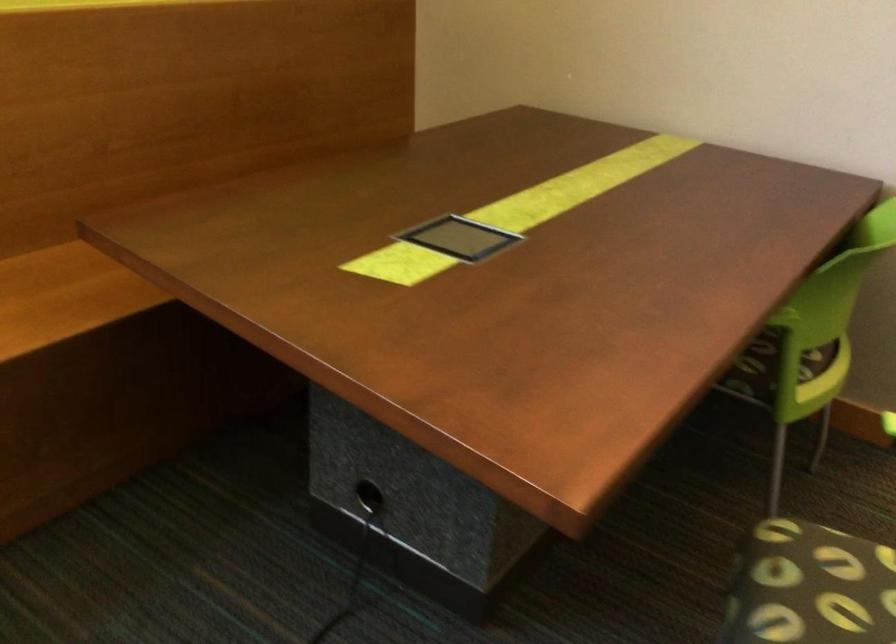
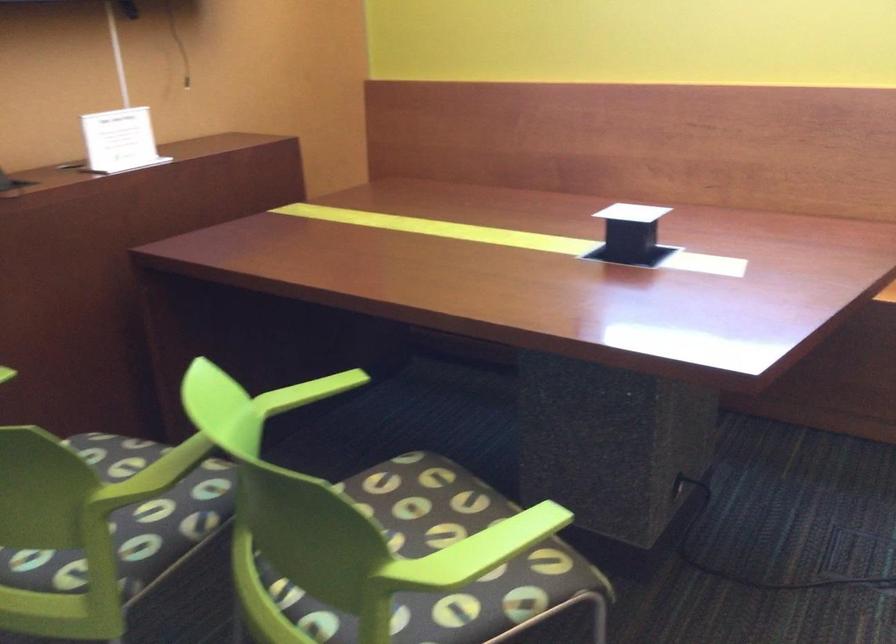
Question: The images are taken continuously from a first-person perspective. In which direction is your viewpoint rotating?

Choices:
 (A) Left
 (B) Right
 (C) Up
 (D) Down

Answer: (A)